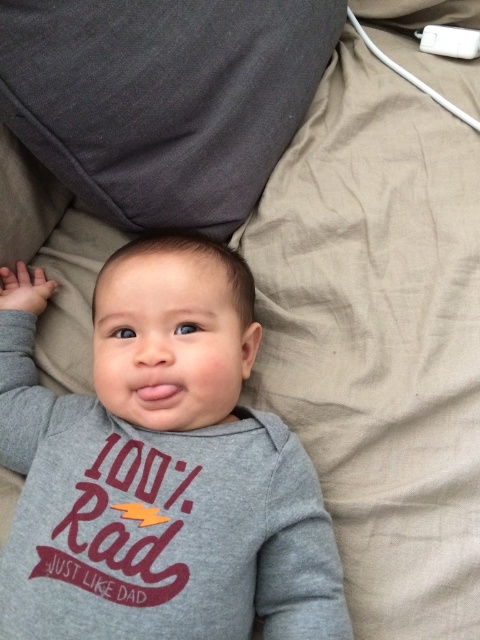
Based on the photo, does dark gray fabric pillow at upper center lie in front of white plastic remote at upper right?

Yes, dark gray fabric pillow at upper center is closer to the viewer.

Does dark gray fabric pillow at upper center appear on the right side of white plastic remote at upper right?

No, dark gray fabric pillow at upper center is not to the right of white plastic remote at upper right.

Does point (96, 156) come farther from viewer compared to point (467, 58)?

No, it is in front of (467, 58).

Where is `dark gray fabric pillow at upper center`? This screenshot has height=640, width=480. dark gray fabric pillow at upper center is located at coordinates (163, 99).

Does gray soft fabric baby at center have a greater width compared to dark gray fabric pillow at upper center?

Indeed, gray soft fabric baby at center has a greater width compared to dark gray fabric pillow at upper center.

Does gray soft fabric baby at center appear on the left side of dark gray fabric pillow at upper center?

Correct, you'll find gray soft fabric baby at center to the left of dark gray fabric pillow at upper center.

Is point (23, 337) behind point (162, 150)?

Yes, it is.

Where is `gray soft fabric baby at center`? This screenshot has width=480, height=640. gray soft fabric baby at center is located at coordinates (158, 467).

Is gray soft fabric baby at center thinner than white plastic remote at upper right?

No.

Does gray soft fabric baby at center have a smaller size compared to white plastic remote at upper right?

Incorrect, gray soft fabric baby at center is not smaller in size than white plastic remote at upper right.

You are a GUI agent. You are given a task and a screenshot of the screen. Output one action in this format:
    pyautogui.click(x=<x>, y=<y>)
    Task: Click on the gray soft fabric baby at center
    
    Given the screenshot: What is the action you would take?
    pyautogui.click(x=158, y=467)